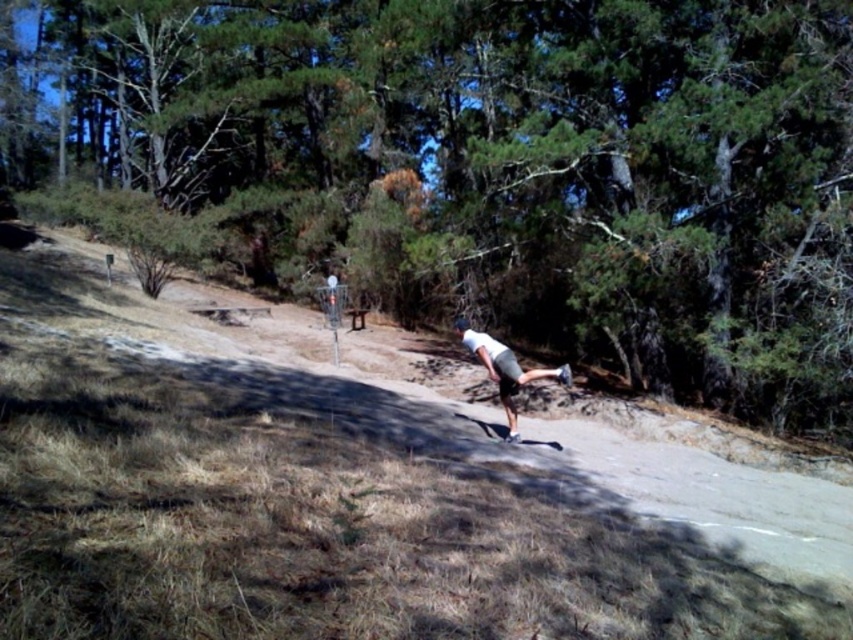
Can you confirm if green leafy tree at center is shorter than white matte skateboard at center?

In fact, green leafy tree at center may be taller than white matte skateboard at center.

Between green leafy tree at center and white matte skateboard at center, which one has more height?

green leafy tree at center is taller.

Where is `green leafy tree at center`? green leafy tree at center is located at coordinates (485, 168).